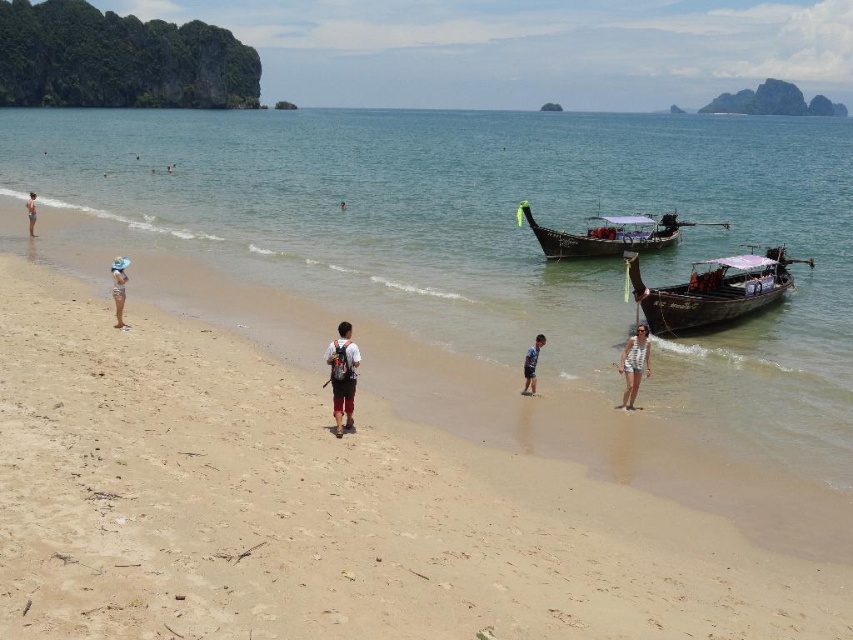
Who is lower down, white striped shorts at lower right or white fabric hat at left?

white striped shorts at lower right

Between point (643, 365) and point (33, 200), which one is positioned behind?

The point (33, 200) is more distant.

This screenshot has width=853, height=640. I want to click on white striped shorts at lower right, so click(x=634, y=364).

Locate an element on the screen. white striped shorts at lower right is located at coordinates (634, 364).

Which of these two, brown sandy beach at lower left or clear water at beach center, stands shorter?

With less height is brown sandy beach at lower left.

Which is below, brown sandy beach at lower left or clear water at beach center?

Positioned lower is brown sandy beach at lower left.

Between point (160, 324) and point (645, 388), which one is positioned in front?

Point (645, 388)

The width and height of the screenshot is (853, 640). Identify the location of brown sandy beach at lower left. (323, 509).

Is brown sandy beach at lower left further to camera compared to dark brown wooden boat at center?

No, it is not.

Between brown sandy beach at lower left and dark brown wooden boat at center, which one appears on the right side from the viewer's perspective?

dark brown wooden boat at center

This screenshot has height=640, width=853. I want to click on brown sandy beach at lower left, so click(x=323, y=509).